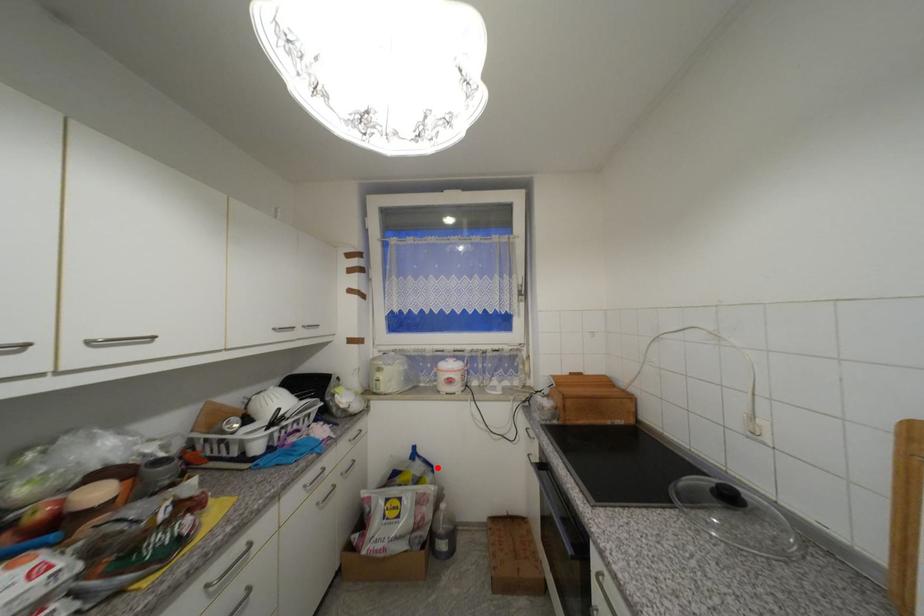
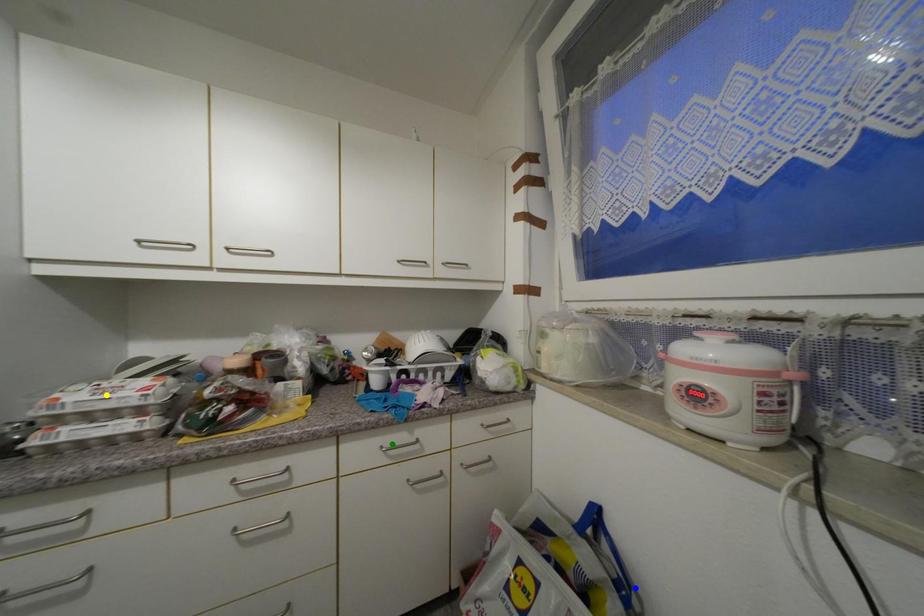
Question: I am providing you with two images of the same scene from different viewpoints. A red point is marked on the first image. You are given multiple points on the second image. Which spot in image 2 lines up with the point in image 1?

Choices:
 (A) yellow point
 (B) green point
 (C) blue point

Answer: (C)